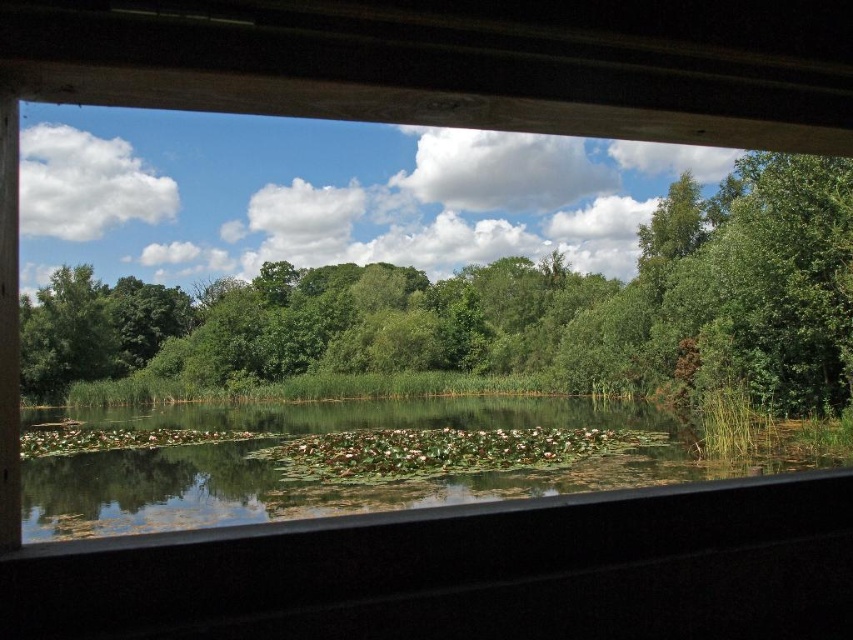
You are standing inside a cabin with a wooden window frame. Looking through the window, you see a point marked at coordinates (503, 308). Based on the scene, what is this point likely pointing to?

The point at coordinates (503, 308) is on a green leafy tree at upper center, so it is pointing to the green leafy tree at upper center.

You are an architect designing a new eco lodge and want to ensure the view from the main window includes both the green leafy tree at upper center and the green leafy water at center. Given their sizes, which one will occupy more space in the window frame?

The green leafy tree at upper center will occupy more space in the window frame because its width is larger than that of the green leafy water at center.

You are standing inside a cabin with a wooden window frame. You notice two points marked on the window glass. The first point is at position point (479, 321) and the second is at point (68, 416). Which point is closer to you through the window?

Point (479, 321) is closer to you than point (68, 416) because it is further to the viewer.